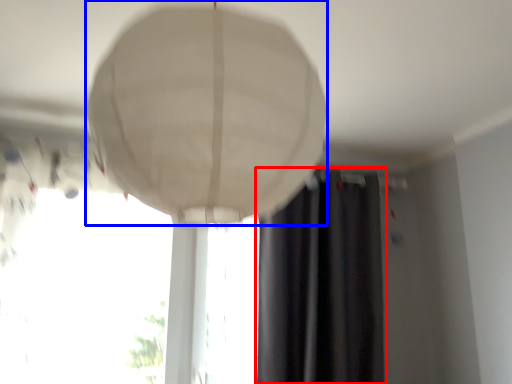
Question: Which of the following is the closest to the observer, curtain (highlighted by a red box) or lamp (highlighted by a blue box)?

Choices:
 (A) curtain
 (B) lamp

Answer: (B)